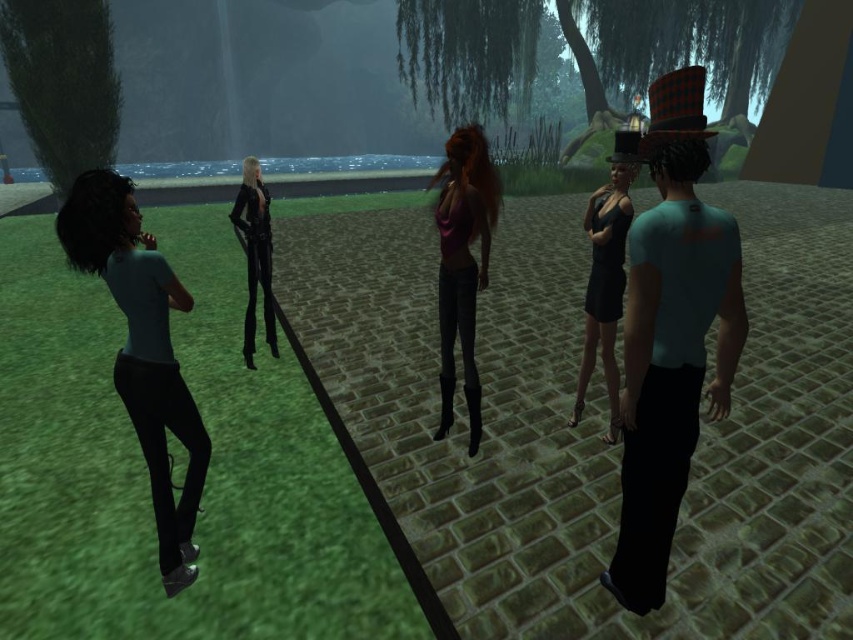
Question: Among these objects, which one is nearest to the camera?

Choices:
 (A) matte blue shirt at left
 (B) shiny purple top at center
 (C) shiny black dress at center
 (D) shiny black leather pants at center

Answer: (A)

Question: Can you confirm if shiny purple top at center is positioned to the left of shiny black dress at center?

Choices:
 (A) yes
 (B) no

Answer: (A)

Question: Among these objects, which one is farthest from the camera?

Choices:
 (A) shiny purple top at center
 (B) matte blue shirt at left

Answer: (A)

Question: In this image, where is shiny purple top at center located relative to shiny black leather pants at center?

Choices:
 (A) above
 (B) below

Answer: (B)

Question: Which point is farther from the camera taking this photo?

Choices:
 (A) (485, 256)
 (B) (590, 304)
 (C) (195, 499)
 (D) (254, 266)

Answer: (D)

Question: Is matte blue shirt at left to the right of shiny black leather pants at center from the viewer's perspective?

Choices:
 (A) no
 (B) yes

Answer: (A)